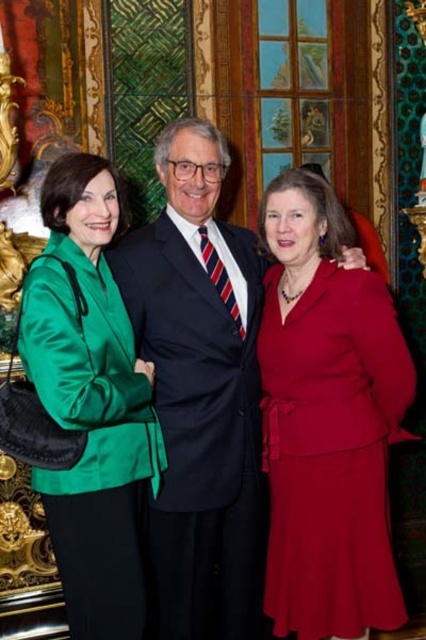
Question: Does matte red dress at center have a smaller size compared to green satin blazer at left?

Choices:
 (A) yes
 (B) no

Answer: (B)

Question: Is matte black suit at center closer to the viewer compared to green satin blazer at left?

Choices:
 (A) no
 (B) yes

Answer: (A)

Question: Which point is farther from the camera taking this photo?

Choices:
 (A) (337, 275)
 (B) (135, 516)
 (C) (192, 410)

Answer: (A)

Question: Estimate the real-world distances between objects in this image. Which object is farther from the matte black suit at center?

Choices:
 (A) green satin blazer at left
 (B) matte red dress at center

Answer: (A)

Question: Which point is farther to the camera?

Choices:
 (A) matte black suit at center
 (B) green satin blazer at left
 (C) matte red dress at center

Answer: (A)

Question: Is matte red dress at center further to the viewer compared to green satin blazer at left?

Choices:
 (A) no
 (B) yes

Answer: (B)